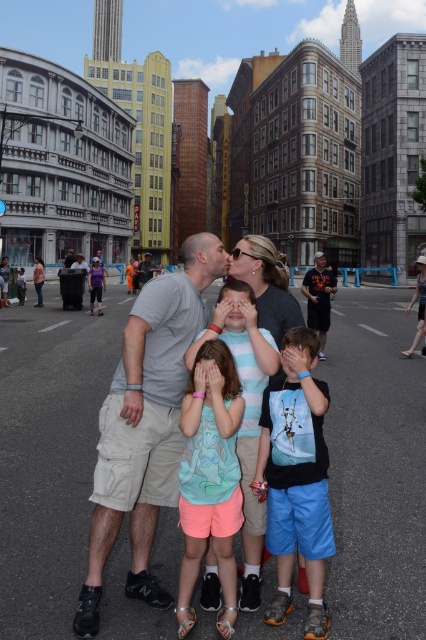
From the picture: Does black matte shirt at center have a greater width compared to matte gray t-shirt at center?

In fact, black matte shirt at center might be narrower than matte gray t-shirt at center.

Find the location of a particular element. The height and width of the screenshot is (640, 426). black matte shirt at center is located at coordinates (296, 480).

Image resolution: width=426 pixels, height=640 pixels. I want to click on black matte shirt at center, so click(296, 480).

At what (x,y) coordinates should I click in order to perform the action: click on black matte shirt at center. Please return your answer as a coordinate pair (x, y). Looking at the image, I should click on (296, 480).

Does black matte shirt at center have a greater height compared to light blue cotton shirt at center?

Yes.

At what (x,y) coordinates should I click in order to perform the action: click on black matte shirt at center. Please return your answer as a coordinate pair (x, y). Image resolution: width=426 pixels, height=640 pixels. Looking at the image, I should click on (296, 480).

Between point (316, 406) and point (204, 461), which one is positioned behind?

Point (316, 406)

Where is `black matte shirt at center`? black matte shirt at center is located at coordinates (296, 480).

Which is behind, point (222, 460) or point (310, 317)?

The point (310, 317) is more distant.

Between light blue cotton shirt at center and orange t-shirt at center, which one has less height?

light blue cotton shirt at center

Between point (209, 444) and point (322, 262), which one is positioned in front?

Point (209, 444)

You are a GUI agent. You are given a task and a screenshot of the screen. Output one action in this format:
    pyautogui.click(x=<x>, y=<y>)
    Task: Click on the light blue cotton shirt at center
    
    Given the screenshot: What is the action you would take?
    pyautogui.click(x=210, y=480)